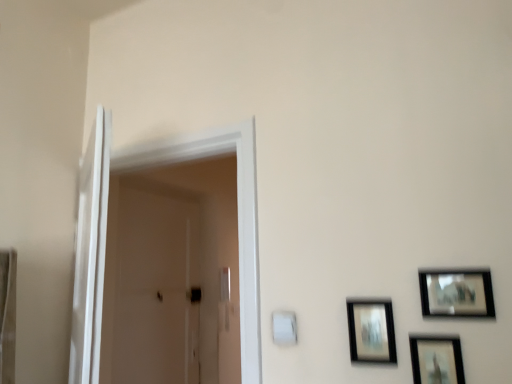
Question: Considering the relative sizes of matte black picture frame at lower right, placed as the first picture frame when sorted from left to right, and matte black picture frame at upper right, placed as the first picture frame when sorted from right to left, in the image provided, is matte black picture frame at lower right, placed as the first picture frame when sorted from left to right, smaller than matte black picture frame at upper right, placed as the first picture frame when sorted from right to left,?

Choices:
 (A) yes
 (B) no

Answer: (B)

Question: From the image's perspective, would you say matte black picture frame at lower right, placed as the first picture frame when sorted from left to right, is positioned over matte black picture frame at upper right, which is counted as the third picture frame, starting from the left?

Choices:
 (A) no
 (B) yes

Answer: (A)

Question: Would you say matte black picture frame at upper right, placed as the first picture frame when sorted from right to left, is part of matte black picture frame at lower right, the 3th picture frame when ordered from right to left,'s contents?

Choices:
 (A) no
 (B) yes

Answer: (A)

Question: Is matte black picture frame at lower right, the 3th picture frame when ordered from right to left, to the right of matte black picture frame at upper right, which is counted as the third picture frame, starting from the left, from the viewer's perspective?

Choices:
 (A) no
 (B) yes

Answer: (A)

Question: Is matte black picture frame at lower right, the 3th picture frame when ordered from right to left, far away from matte black picture frame at upper right, placed as the first picture frame when sorted from right to left?

Choices:
 (A) yes
 (B) no

Answer: (B)

Question: Would you say matte black picture frame at lower right, placed as the first picture frame when sorted from left to right, is outside matte black picture frame at upper right, placed as the first picture frame when sorted from right to left?

Choices:
 (A) no
 (B) yes

Answer: (B)

Question: From a real-world perspective, is matte black picture frame at lower right, the 3th picture frame when ordered from right to left, on white glossy door at left, the 2th screen door in the front-to-back sequence?

Choices:
 (A) no
 (B) yes

Answer: (A)

Question: Is matte black picture frame at lower right, the 3th picture frame when ordered from right to left, to the right of white glossy door at left, placed as the first screen door when sorted from back to front, from the viewer's perspective?

Choices:
 (A) no
 (B) yes

Answer: (B)

Question: Can you confirm if matte black picture frame at lower right, placed as the first picture frame when sorted from left to right, is bigger than white glossy door at left, the 2th screen door in the front-to-back sequence?

Choices:
 (A) no
 (B) yes

Answer: (A)

Question: Considering the relative sizes of matte black picture frame at lower right, placed as the first picture frame when sorted from left to right, and white glossy door at left, placed as the first screen door when sorted from back to front, in the image provided, is matte black picture frame at lower right, placed as the first picture frame when sorted from left to right, taller than white glossy door at left, placed as the first screen door when sorted from back to front,?

Choices:
 (A) no
 (B) yes

Answer: (A)

Question: Is matte black picture frame at lower right, the 3th picture frame when ordered from right to left, wider than white glossy door at left, the 2th screen door in the front-to-back sequence?

Choices:
 (A) no
 (B) yes

Answer: (A)

Question: Is matte black picture frame at lower right, placed as the first picture frame when sorted from left to right, thinner than white glossy door at left, placed as the first screen door when sorted from back to front?

Choices:
 (A) yes
 (B) no

Answer: (A)

Question: Can you confirm if white glossy door at left is thinner than white glossy door at left, placed as the first screen door when sorted from back to front?

Choices:
 (A) no
 (B) yes

Answer: (A)